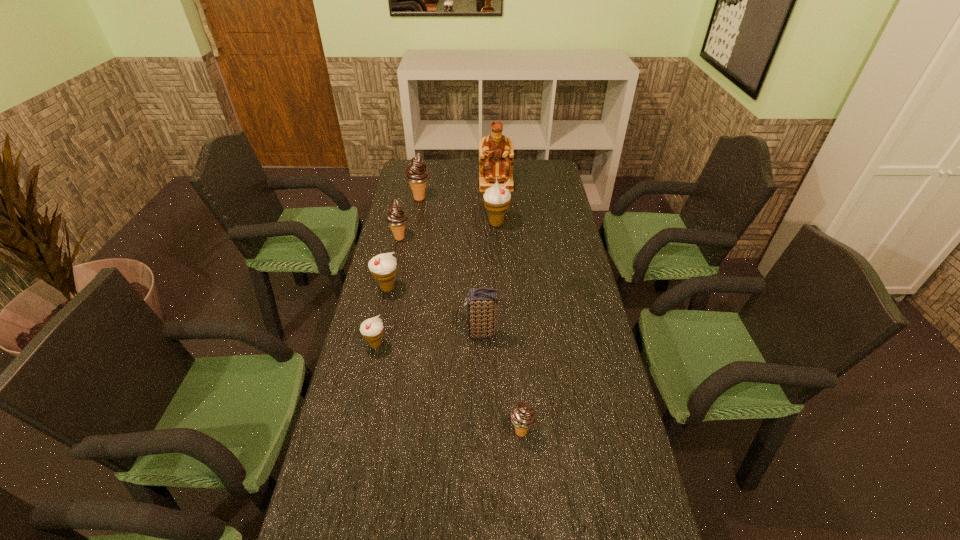
Find the location of a particular element. The height and width of the screenshot is (540, 960). vacant space located 0.160m on the front of the third nearest icecream is located at coordinates (377, 335).

Identify the location of vacant space located 0.310m on the back of the nearest white icecream. This screenshot has height=540, width=960. (393, 269).

Locate an element on the screen. The height and width of the screenshot is (540, 960). vacant space located 0.400m on the left of the smallest chocolate icecream is located at coordinates (350, 431).

Where is `object that is at the far edge`? This screenshot has width=960, height=540. object that is at the far edge is located at coordinates (496, 156).

Locate an element on the screen. free space at the left edge of the desktop is located at coordinates [x=406, y=242].

You are a GUI agent. You are given a task and a screenshot of the screen. Output one action in this format:
    pyautogui.click(x=<x>, y=<y>)
    Task: Click on the vacant space at the right edge
    This screenshot has height=540, width=960.
    Given the screenshot: What is the action you would take?
    pyautogui.click(x=636, y=525)

The height and width of the screenshot is (540, 960). Identify the location of vacant space at the far left corner. (433, 185).

Where is `free space between the second biggest chocolate icecream and the clutch bag`? This screenshot has height=540, width=960. free space between the second biggest chocolate icecream and the clutch bag is located at coordinates (442, 286).

This screenshot has height=540, width=960. I want to click on unoccupied area between the farthest white icecream and the fifth farthest icecream, so click(x=436, y=285).

Image resolution: width=960 pixels, height=540 pixels. I want to click on free space that is in between the third nearest icecream and the nearest chocolate icecream, so click(454, 360).